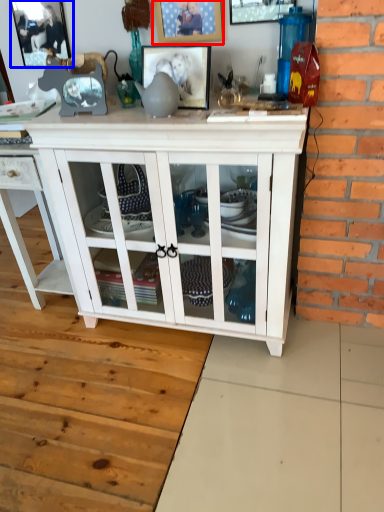
Question: Which object appears closest to the camera in this image, picture frame (highlighted by a red box) or picture frame (highlighted by a blue box)?

Choices:
 (A) picture frame
 (B) picture frame

Answer: (A)